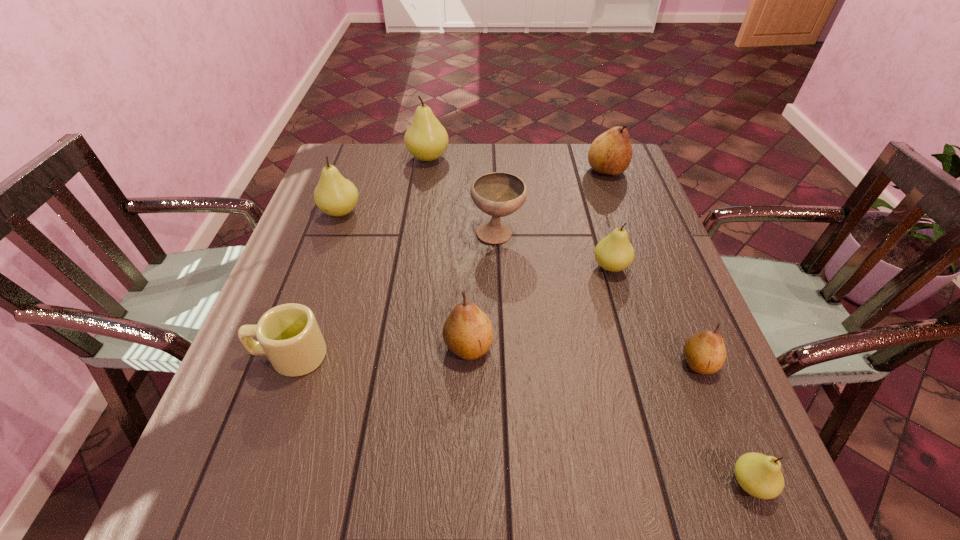
Point out which green pear is positioned as the second nearest to the leftmost green pear. Please provide its 2D coordinates. Your answer should be formatted as a tuple, i.e. [(x, y)], where the tuple contains the x and y coordinates of a point satisfying the conditions above.

[(614, 253)]

Identify which brown pear is located as the nearest to the fourth farthest pear. Please provide its 2D coordinates. Your answer should be formatted as a tuple, i.e. [(x, y)], where the tuple contains the x and y coordinates of a point satisfying the conditions above.

[(705, 352)]

Locate which brown pear is the closest to the nearest object. Please provide its 2D coordinates. Your answer should be formatted as a tuple, i.e. [(x, y)], where the tuple contains the x and y coordinates of a point satisfying the conditions above.

[(705, 352)]

Find the location of a particular element. Image resolution: width=960 pixels, height=540 pixels. vacant position in the image that satisfies the following two spatial constraints: 1. on the back side of the leftmost brown pear; 2. on the right side of the farthest brown pear is located at coordinates (472, 171).